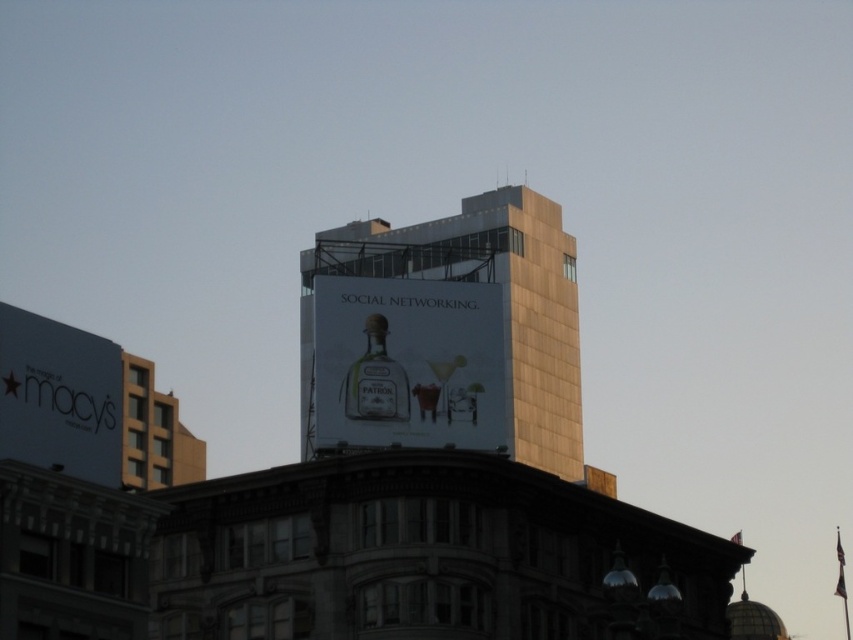
You are a delivery person trying to navigate between the gold metallic building at center and the clear glass bottle at center. Which object should you avoid bumping into to ensure safe passage?

The gold metallic building at center is wider than the clear glass bottle at center, so you should avoid bumping into the gold metallic building at center to ensure safe passage.

You are a city planner trying to install a new streetlight between the gold metallic building at center and the white glossy sign at lower left. The streetlight requires a minimum distance of 150 feet between the two objects to be installed safely. Based on the given information, can the streetlight be placed there?

The gold metallic building at center is 171.07 feet from the white glossy sign at lower left. Since the required minimum distance is 150 feet, the streetlight can be safely installed between them as the distance is sufficient.

You are looking at the image of the urban scene. There is a point at coordinate (408, 364). What object is located at that point?

The point at coordinate (408, 364) corresponds to the matte glass bottle at upper center.